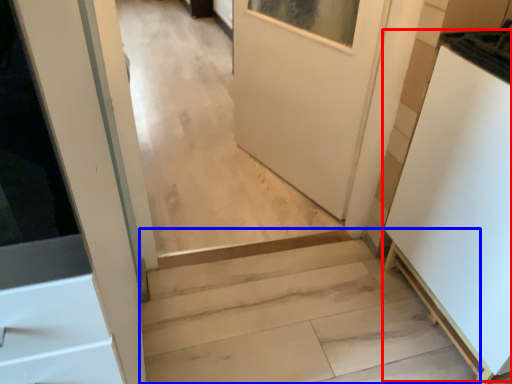
Question: Which object is further to the camera taking this photo, appliance (highlighted by a red box) or stairs (highlighted by a blue box)?

Choices:
 (A) appliance
 (B) stairs

Answer: (B)